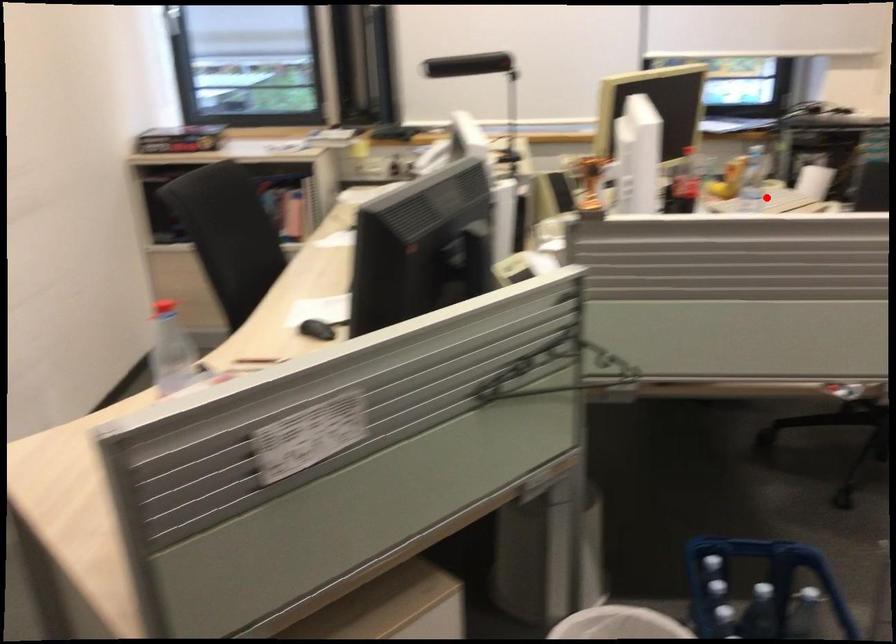
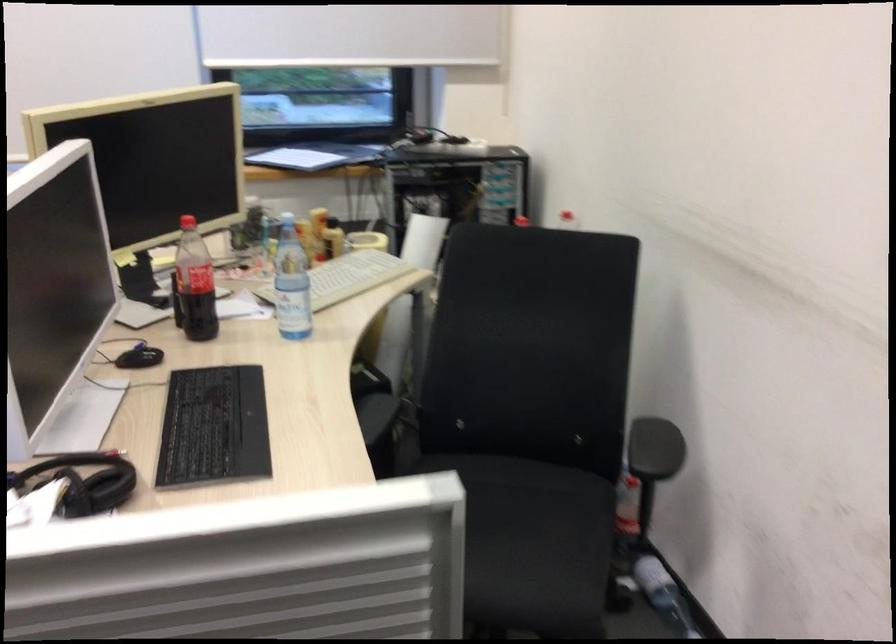
Question: I am providing you with two images of the same scene from different viewpoints. Given a red point in image1, look at the same physical point in image2. Is it:

Choices:
 (A) Closer to the viewpoint
 (B) Farther from the viewpoint

Answer: (A)